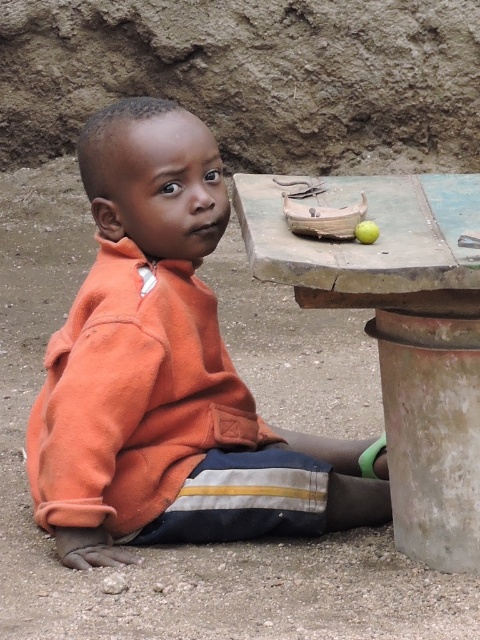
Who is lower down, blue painted wood picnic table at upper center or green matte apple at upper center?

blue painted wood picnic table at upper center is below.

Is blue painted wood picnic table at upper center taller than green matte apple at upper center?

Indeed, blue painted wood picnic table at upper center has a greater height compared to green matte apple at upper center.

Between point (462, 465) and point (363, 236), which one is positioned in front?

Point (363, 236)

Where is `blue painted wood picnic table at upper center`? The height and width of the screenshot is (640, 480). blue painted wood picnic table at upper center is located at coordinates (399, 333).

Based on the photo, does orange fleece jacket at center have a larger size compared to green matte apple at upper center?

Yes, orange fleece jacket at center is bigger than green matte apple at upper center.

Is point (192, 461) positioned after point (357, 225)?

Yes, point (192, 461) is behind point (357, 225).

Locate an element on the screen. The height and width of the screenshot is (640, 480). orange fleece jacket at center is located at coordinates pyautogui.click(x=168, y=374).

Who is more forward, (x=94, y=429) or (x=417, y=310)?

Point (x=417, y=310) is more forward.

Which is in front, point (265, 444) or point (392, 467)?

Point (392, 467) is more forward.

Where is `orange fleece jacket at center`? This screenshot has height=640, width=480. orange fleece jacket at center is located at coordinates (168, 374).